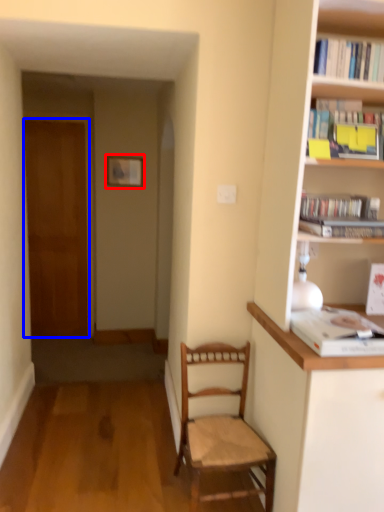
Question: Which object is closer to the camera taking this photo, picture frame (highlighted by a red box) or door (highlighted by a blue box)?

Choices:
 (A) picture frame
 (B) door

Answer: (A)